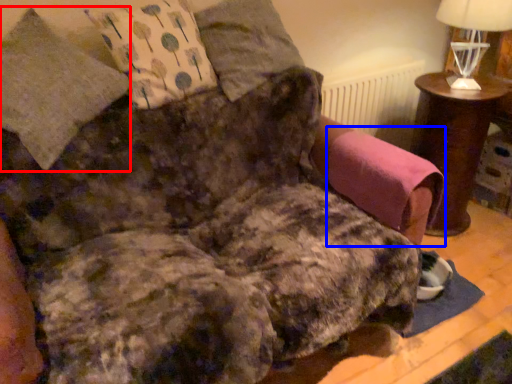
Question: Which of the following is the farthest to the observer, pillow (highlighted by a red box) or swivel chair (highlighted by a blue box)?

Choices:
 (A) pillow
 (B) swivel chair

Answer: (B)